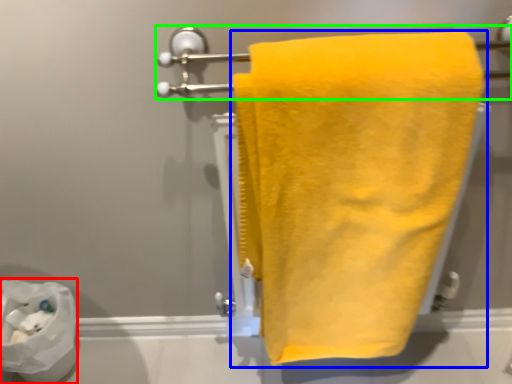
Question: Which object is positioned farthest from toilet paper (highlighted by a red box)? Select from towel (highlighted by a blue box) and towel bar (highlighted by a green box).

Choices:
 (A) towel
 (B) towel bar

Answer: (A)